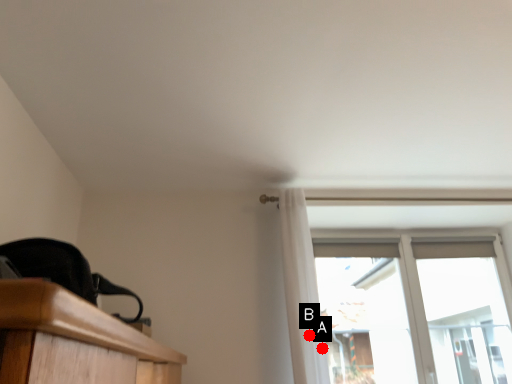
Question: Two points are circled on the image, labeled by A and B beside each circle. Which point is closer to the camera?

Choices:
 (A) A is closer
 (B) B is closer

Answer: (A)